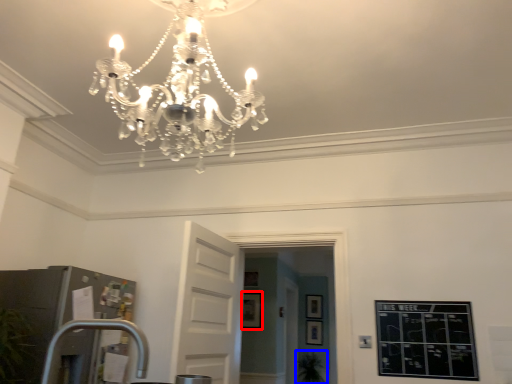
Question: Which object appears closest to the camera in this image, picture frame (highlighted by a red box) or plant (highlighted by a blue box)?

Choices:
 (A) picture frame
 (B) plant

Answer: (A)